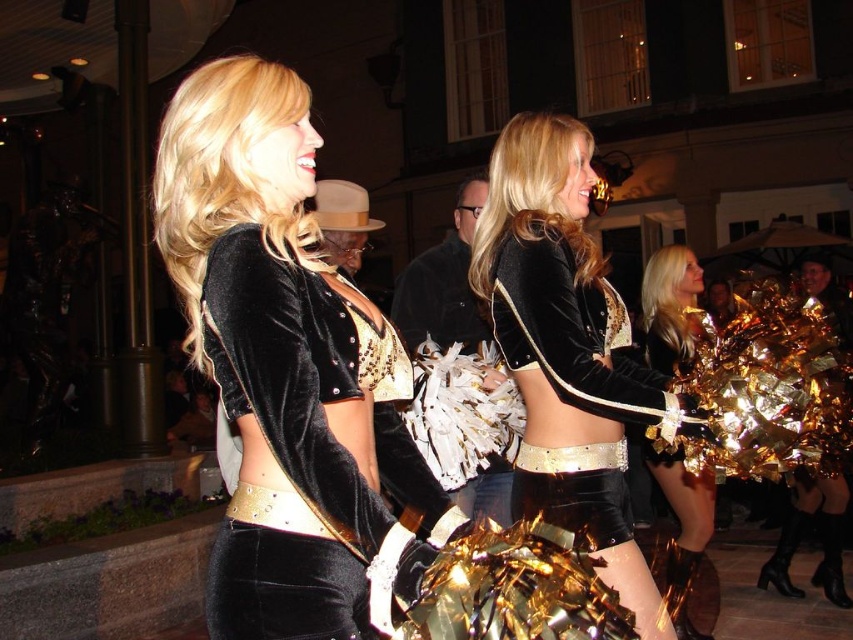
You are standing in the middle of the scene and want to move towards the closest point between point (x=216, y=266) and point (x=680, y=323). Which point should you walk towards?

Point (x=216, y=266) is closer to the viewer than point (x=680, y=323), so you should walk towards point (x=216, y=266).